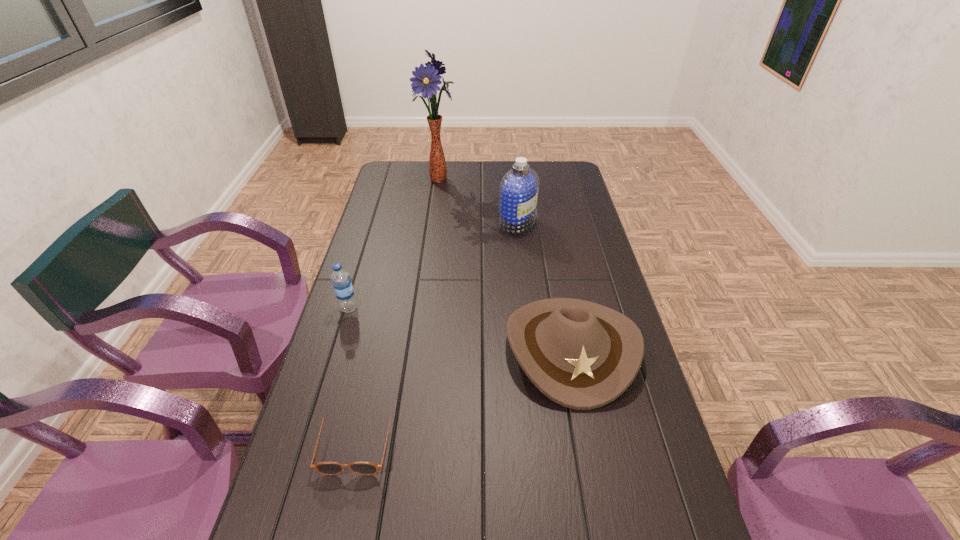
Identify the location of the tallest object. (426, 80).

Identify the location of the farthest object. This screenshot has width=960, height=540. (426, 80).

Locate an element on the screen. the second tallest object is located at coordinates (518, 191).

Identify the location of the second farthest object. The image size is (960, 540). 518,191.

Find the location of a particular element. Image resolution: width=960 pixels, height=540 pixels. water bottle is located at coordinates (341, 280).

Where is `the third tallest object`? the third tallest object is located at coordinates (341, 280).

This screenshot has height=540, width=960. Identify the location of the fourth tallest object. (582, 355).

I want to click on the shortest object, so click(326, 468).

This screenshot has height=540, width=960. Identify the location of the nearest object. coord(326,468).

The height and width of the screenshot is (540, 960). In order to click on vacant area situated on the right of the flower arrangement in this screenshot , I will do `click(492, 179)`.